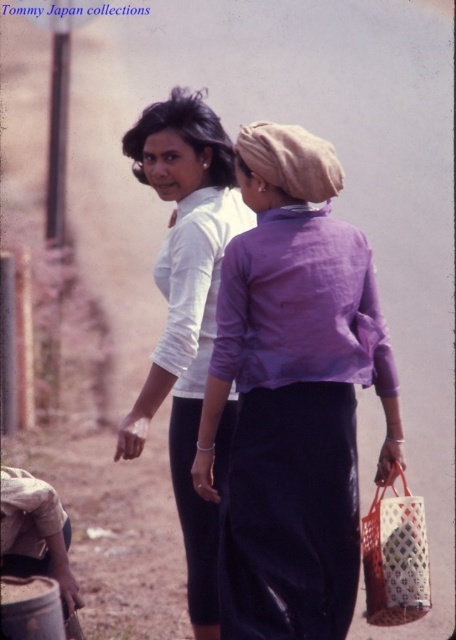
Which is above, matte white blouse at center or white woven basket at lower right?

matte white blouse at center is above.

Is matte white blouse at center to the right of white woven basket at lower right from the viewer's perspective?

No, matte white blouse at center is not to the right of white woven basket at lower right.

Find the location of `matte white blouse at center`. matte white blouse at center is located at coordinates (186, 308).

Does purple cotton shirt at center appear on the left side of matte white blouse at center?

In fact, purple cotton shirt at center is to the right of matte white blouse at center.

Based on the photo, which is more to the left, purple cotton shirt at center or matte white blouse at center?

matte white blouse at center is more to the left.

This screenshot has height=640, width=456. In order to click on purple cotton shirt at center in this screenshot , I will do [294, 394].

Looking at this image, is purple cotton shirt at center to the left of white woven basket at lower right from the viewer's perspective?

Yes, purple cotton shirt at center is to the left of white woven basket at lower right.

Can you confirm if purple cotton shirt at center is taller than white woven basket at lower right?

Yes.

Measure the distance between point [314,428] and camera.

They are 3.93 meters apart.

Where is `purple cotton shirt at center`? The width and height of the screenshot is (456, 640). purple cotton shirt at center is located at coordinates (294, 394).